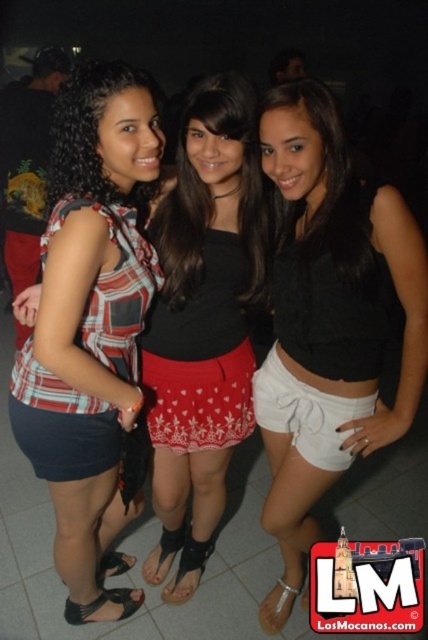
Question: Is black matte shorts at center thinner than plaid fabric top at center?

Choices:
 (A) no
 (B) yes

Answer: (B)

Question: Can you confirm if black matte shorts at center is positioned to the right of red printed skirt at center?

Choices:
 (A) no
 (B) yes

Answer: (B)

Question: Which point is farther from the camera taking this photo?

Choices:
 (A) (157, 392)
 (B) (47, 252)
 (C) (278, 376)

Answer: (A)

Question: Which point is farther from the camera taking this photo?

Choices:
 (A) (92, 390)
 (B) (246, 301)

Answer: (B)

Question: Among these points, which one is nearest to the camera?

Choices:
 (A) (256, 403)
 (B) (59, 486)
 (C) (222, 268)

Answer: (B)

Question: Is black matte shorts at center wider than plaid fabric top at center?

Choices:
 (A) no
 (B) yes

Answer: (A)